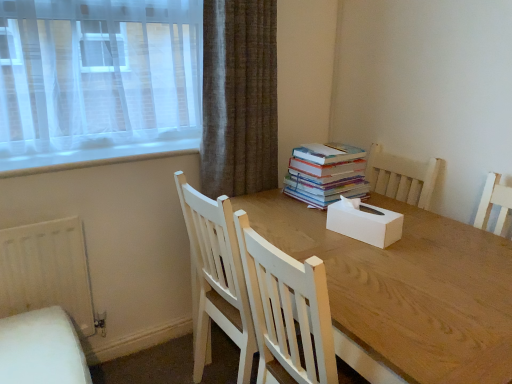
Image resolution: width=512 pixels, height=384 pixels. Identify the location of free space that is to the left of white cardboard tissue box at center. (310, 230).